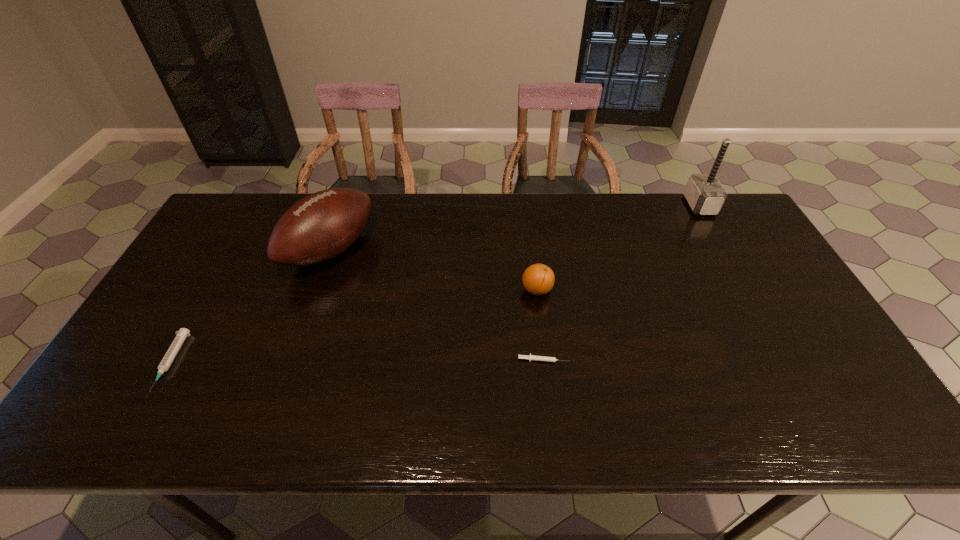
Where is `hammer`? The width and height of the screenshot is (960, 540). hammer is located at coordinates (704, 193).

Locate an element on the screen. the rightmost object is located at coordinates (704, 193).

Where is `the fourth object from right to left`? Image resolution: width=960 pixels, height=540 pixels. the fourth object from right to left is located at coordinates (322, 225).

Where is `football (American)`? football (American) is located at coordinates (322, 225).

This screenshot has width=960, height=540. I want to click on the third shortest object, so click(x=538, y=279).

Identify the location of the second shortest object. (171, 353).

Where is `the left syringe`? the left syringe is located at coordinates (171, 353).

Locate an element on the screen. This screenshot has height=540, width=960. the right syringe is located at coordinates (536, 358).

The image size is (960, 540). What are the coordinates of `the shortest object` in the screenshot? It's located at (536, 358).

This screenshot has height=540, width=960. Find the location of `free spot located 0.060m for striking with the head of the hammer`. free spot located 0.060m for striking with the head of the hammer is located at coordinates (669, 205).